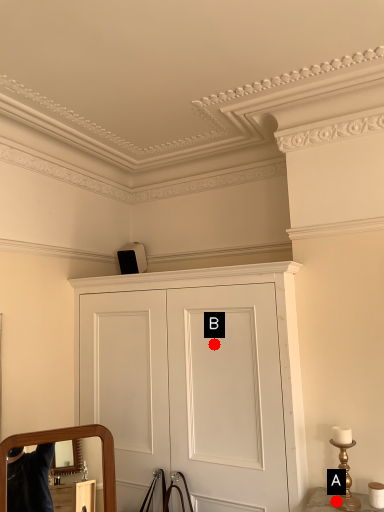
Question: Two points are circled on the image, labeled by A and B beside each circle. Which of the following is the closest to the observer?

Choices:
 (A) A is closer
 (B) B is closer

Answer: (A)